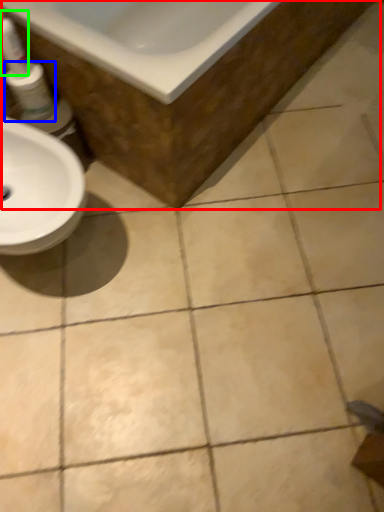
Question: Which object is the closest to the bath (highlighted by a red box)? Choose among these: mouthwash (highlighted by a blue box) or cleaning product (highlighted by a green box).

Choices:
 (A) mouthwash
 (B) cleaning product

Answer: (A)